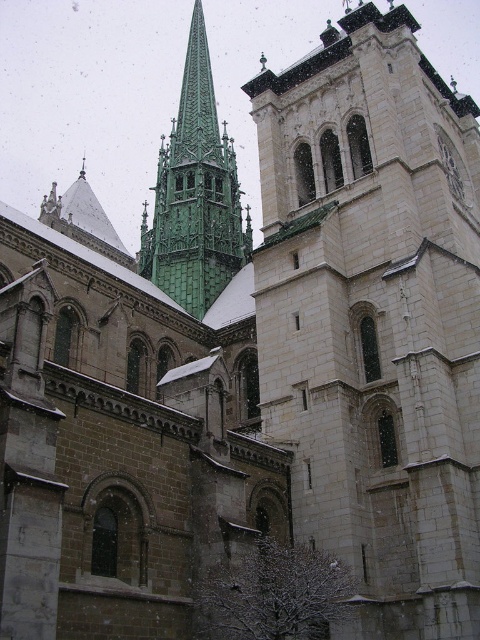
Which is above, white stone tower at center or green stone spire at upper left?

green stone spire at upper left

Can you confirm if white stone tower at center is bigger than green stone spire at upper left?

Incorrect, white stone tower at center is not larger than green stone spire at upper left.

The height and width of the screenshot is (640, 480). In order to click on white stone tower at center in this screenshot , I will do `click(374, 317)`.